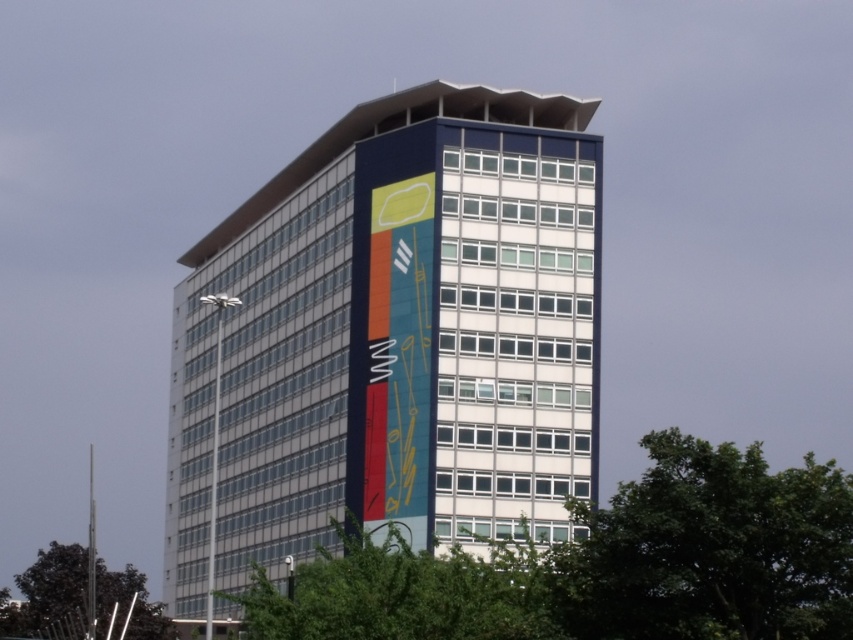
You are standing at the exact center of the image. Looking at the blue glossy building at center, can you determine its exact coordinates relative to your position?

The blue glossy building at center is located at coordinates point (392, 339).